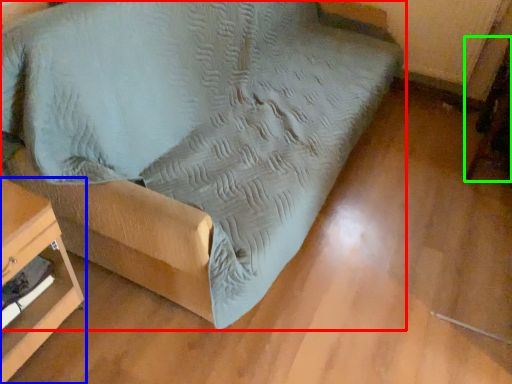
Question: Estimate the real-world distances between objects in this image. Which object is farther from furniture (highlighted by a red box), furniture (highlighted by a blue box) or swivel chair (highlighted by a green box)?

Choices:
 (A) furniture
 (B) swivel chair

Answer: (B)